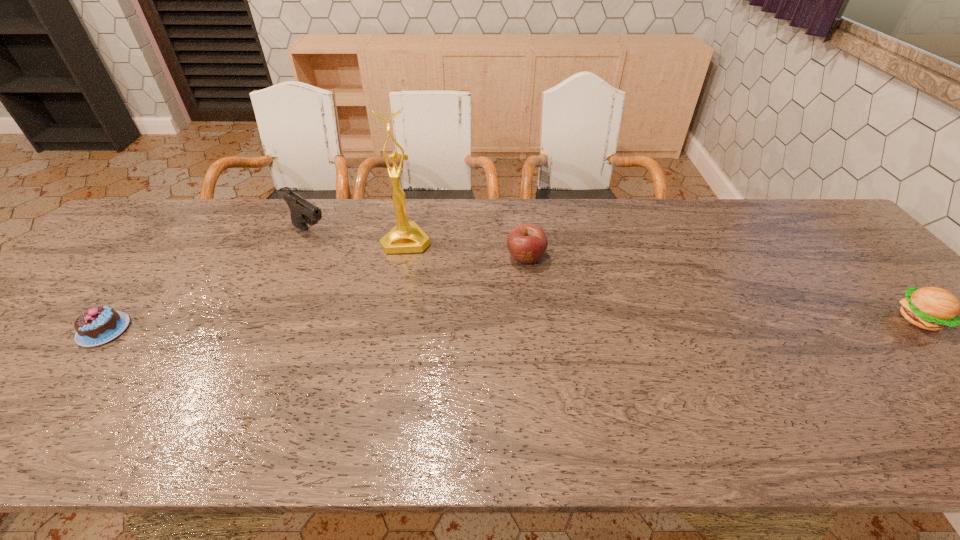
Identify the location of free space between the apple and the award. Image resolution: width=960 pixels, height=540 pixels. click(x=467, y=249).

Locate which object ranks third in proximity to the fourth object from right to left. Please provide its 2D coordinates. Your answer should be formatted as a tuple, i.e. [(x, y)], where the tuple contains the x and y coordinates of a point satisfying the conditions above.

[(527, 243)]

Choose which object is the fourth nearest neighbor to the leftmost object. Please provide its 2D coordinates. Your answer should be formatted as a tuple, i.e. [(x, y)], where the tuple contains the x and y coordinates of a point satisfying the conditions above.

[(930, 308)]

The height and width of the screenshot is (540, 960). Find the location of `vacant space that satisfies the following two spatial constraints: 1. on the front side of the apple; 2. on the right side of the fourth shortest object`. vacant space that satisfies the following two spatial constraints: 1. on the front side of the apple; 2. on the right side of the fourth shortest object is located at coordinates (299, 258).

Where is `blank area in the image that satisfies the following two spatial constraints: 1. on the front side of the pistol; 2. on the left side of the apple`? Image resolution: width=960 pixels, height=540 pixels. blank area in the image that satisfies the following two spatial constraints: 1. on the front side of the pistol; 2. on the left side of the apple is located at coordinates (299, 258).